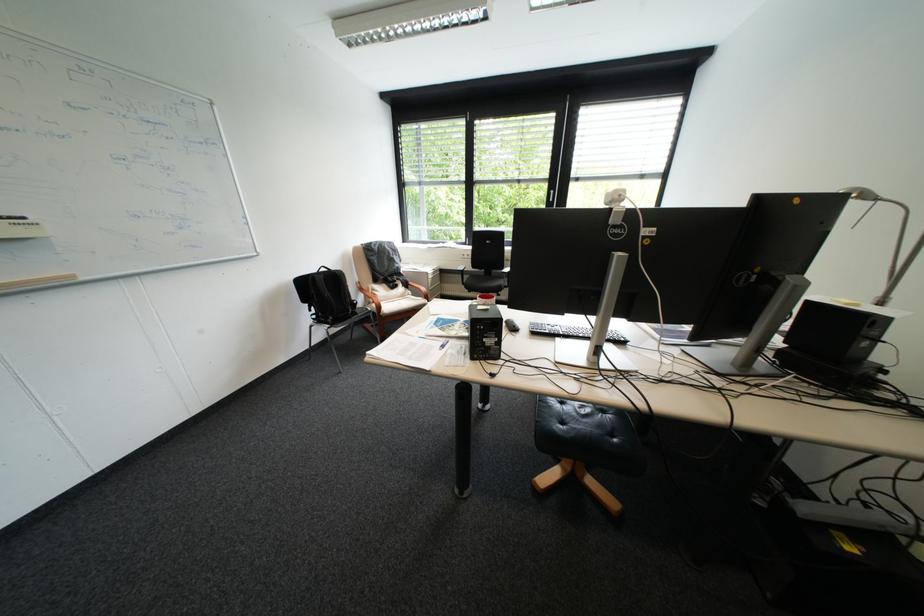
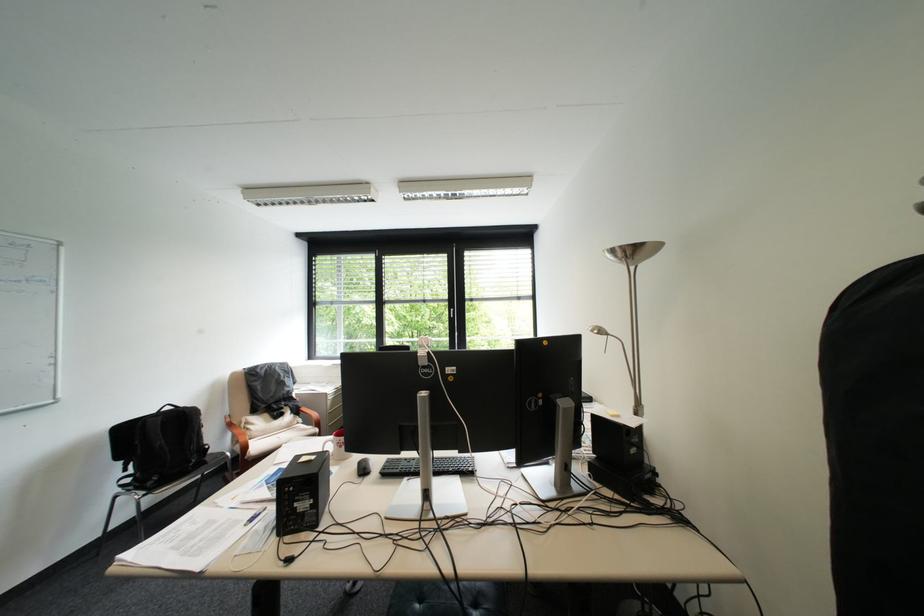
Locate, in the second image, the point that corresponds to point (373, 297) in the first image.

(241, 434)